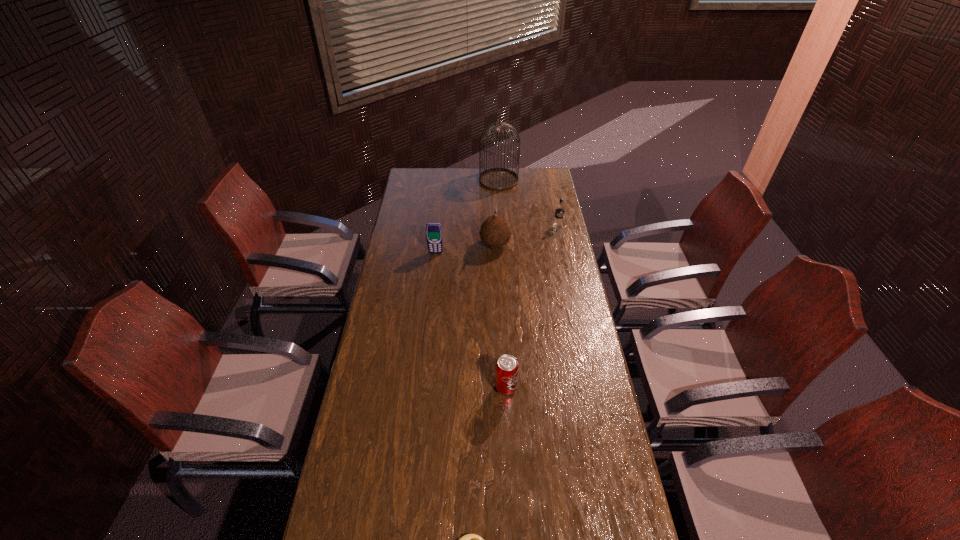
Find the location of a particular element. Image resolution: width=960 pixels, height=540 pixels. the farthest object is located at coordinates (x=498, y=179).

Where is `the tallest object`? This screenshot has height=540, width=960. the tallest object is located at coordinates (498, 179).

This screenshot has width=960, height=540. Find the location of `coconut`. coconut is located at coordinates (495, 231).

You are a GUI agent. You are given a task and a screenshot of the screen. Output one action in this format:
    pyautogui.click(x=<x>, y=<y>)
    Task: Click on the cellular telephone
    
    Given the screenshot: What is the action you would take?
    pyautogui.click(x=434, y=237)

Locate an element on the screen. The image size is (960, 540). the fifth nearest object is located at coordinates (559, 211).

Find the location of a particular element. The height and width of the screenshot is (540, 960). the rightmost object is located at coordinates (559, 211).

The width and height of the screenshot is (960, 540). I want to click on the fifth farthest object, so click(506, 373).

At what (x,y) coordinates should I click in order to perform the action: click on free space located on the left of the tallest object. Please return your answer as a coordinate pair (x, y). Looking at the image, I should click on (426, 180).

The height and width of the screenshot is (540, 960). Find the location of `vacant point located on the surface of the fifth shortest object`. vacant point located on the surface of the fifth shortest object is located at coordinates (428, 245).

Identify the location of free space located 0.400m on the surface of the fifth shortest object. (394, 245).